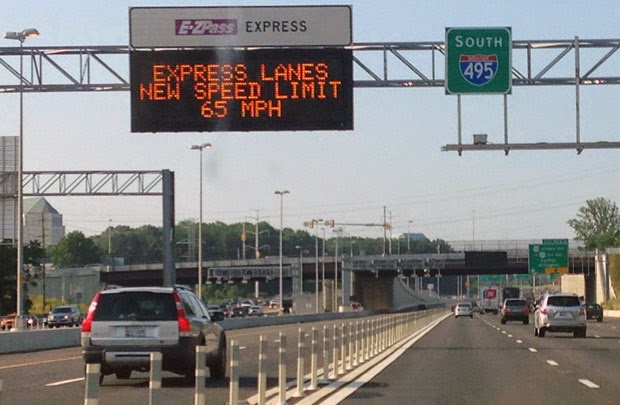
Identify the location of plate. The image size is (620, 405). (134, 330).